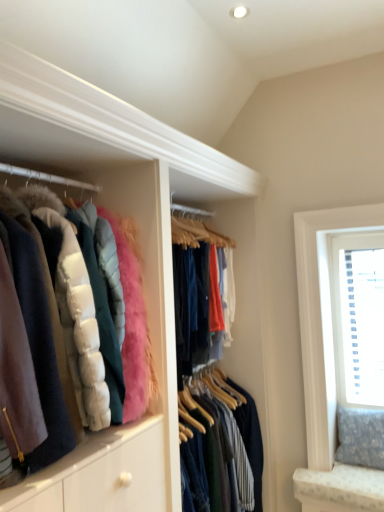
Question: Is velvet-like pink puffer jacket at left taller or shorter than white textured blinds at upper right?

Choices:
 (A) short
 (B) tall

Answer: (A)

Question: Considering the positions of velvet-like pink puffer jacket at left and white textured blinds at upper right in the image, is velvet-like pink puffer jacket at left wider or thinner than white textured blinds at upper right?

Choices:
 (A) thin
 (B) wide

Answer: (B)

Question: Looking at the image, does velvet-like pink puffer jacket at left seem bigger or smaller compared to white textured blinds at upper right?

Choices:
 (A) small
 (B) big

Answer: (B)

Question: In terms of height, does white textured blinds at upper right look taller or shorter compared to velvet-like pink puffer jacket at left?

Choices:
 (A) tall
 (B) short

Answer: (A)

Question: Relative to velvet-like pink puffer jacket at left, is white textured blinds at upper right in front or behind?

Choices:
 (A) behind
 (B) front

Answer: (A)

Question: Looking at their shapes, would you say white textured blinds at upper right is wider or thinner than velvet-like pink puffer jacket at left?

Choices:
 (A) thin
 (B) wide

Answer: (A)

Question: From a real-world perspective, relative to velvet-like pink puffer jacket at left, is white textured blinds at upper right vertically above or below?

Choices:
 (A) below
 (B) above

Answer: (A)